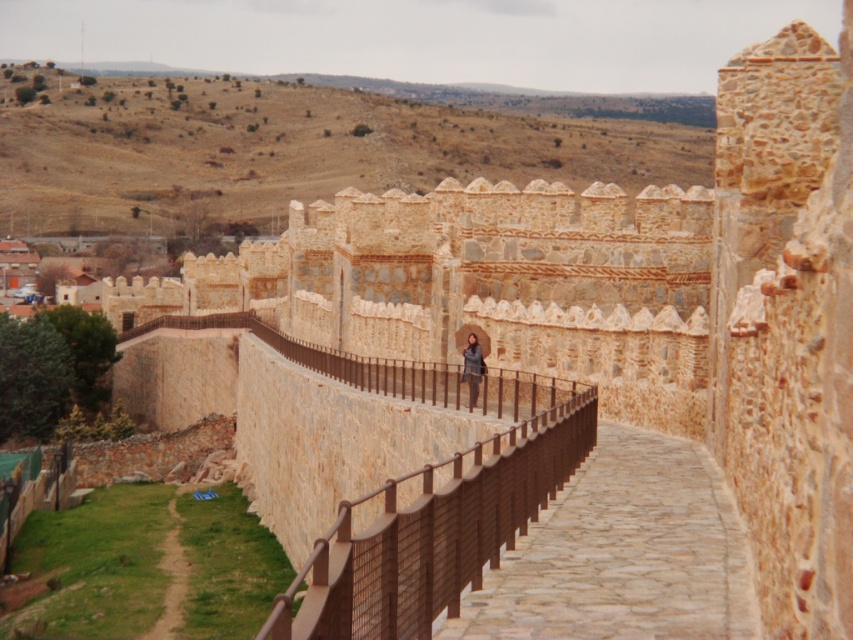
You are standing at the base of the historic stone wall and want to reach the point marked at coordinates point (x=440, y=476). Given that the path along the wall is 60 meters long, can you safely walk to that point without exceeding the path length?

The point (x=440, y=476) is 58.64 meters away from the viewer, which is within the 60 meter path length. Therefore, you can safely walk to that point without exceeding the path length.